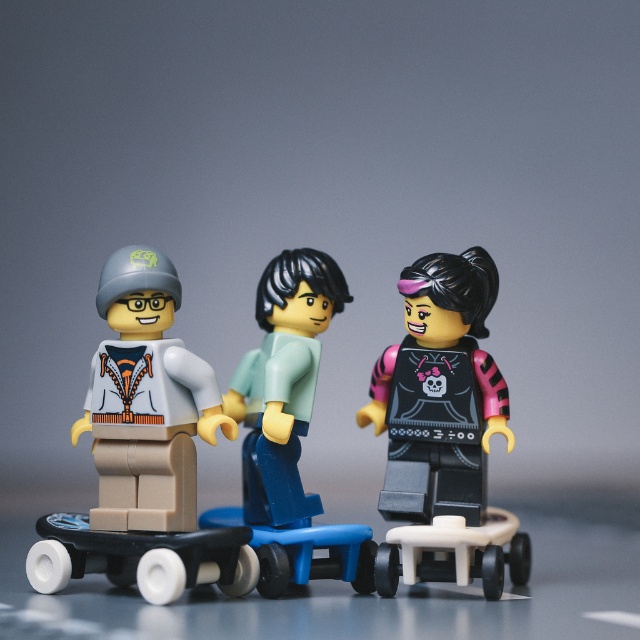
Is matte black skateboard at center taller than white plastic skateboard at lower right?

Yes, matte black skateboard at center is taller than white plastic skateboard at lower right.

Can you confirm if matte black skateboard at center is bigger than white plastic skateboard at lower right?

Indeed, matte black skateboard at center has a larger size compared to white plastic skateboard at lower right.

The image size is (640, 640). What do you see at coordinates (358, 422) in the screenshot?
I see `matte black skateboard at center` at bounding box center [358, 422].

Locate an element on the screen. matte black skateboard at center is located at coordinates (358, 422).

Can you confirm if matte white jacket at center is wider than light blue plastic figure at center?

Yes.

Which is in front, point (134, 451) or point (260, 401)?

Point (134, 451)

Where is `matte white jacket at center`? The width and height of the screenshot is (640, 640). matte white jacket at center is located at coordinates (154, 448).

Which is above, matte white jacket at center or white plastic skateboard at lower right?

Positioned higher is matte white jacket at center.

Can you confirm if matte white jacket at center is positioned below white plastic skateboard at lower right?

Actually, matte white jacket at center is above white plastic skateboard at lower right.

Does point (161, 449) lie in front of point (412, 582)?

No, (161, 449) is further to viewer.

Locate an element on the screen. The image size is (640, 640). matte white jacket at center is located at coordinates pyautogui.click(x=154, y=448).